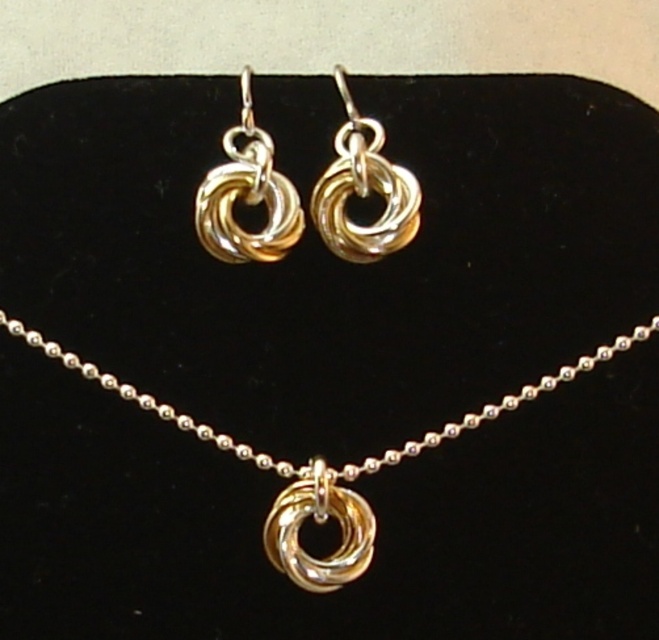
Question: Is the position of gold shiny knot at upper center more distant than that of gold shiny knot at upper left?

Choices:
 (A) no
 (B) yes

Answer: (B)

Question: Which point is closer to the camera?

Choices:
 (A) (227, 193)
 (B) (378, 154)

Answer: (B)

Question: Is the position of gold shiny knot at upper center less distant than that of gold shiny knot at upper left?

Choices:
 (A) no
 (B) yes

Answer: (A)

Question: Which point appears farthest from the camera in this image?

Choices:
 (A) (204, 228)
 (B) (420, 200)

Answer: (A)

Question: Can you confirm if gold shiny knot at upper center is wider than gold shiny knot at upper left?

Choices:
 (A) no
 (B) yes

Answer: (B)